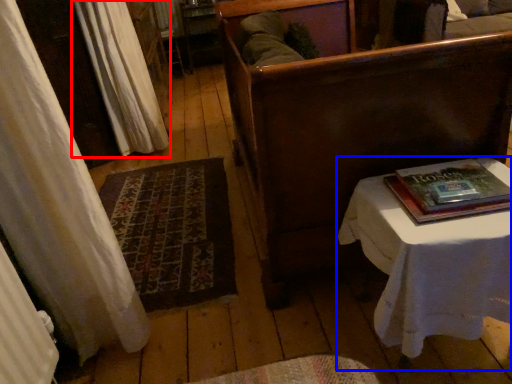
Question: Which object is further to the camera taking this photo, curtain (highlighted by a red box) or table (highlighted by a blue box)?

Choices:
 (A) curtain
 (B) table

Answer: (A)